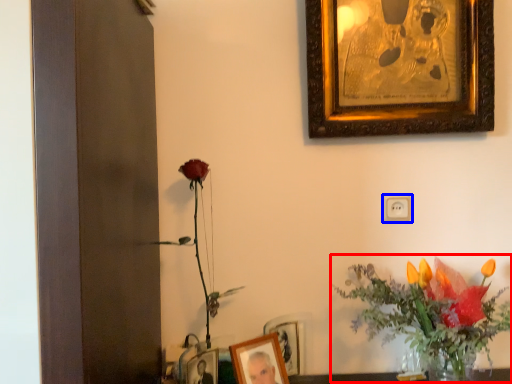
Question: Which object appears closest to the camera in this image, floral arrangement (highlighted by a red box) or electric outlet (highlighted by a blue box)?

Choices:
 (A) floral arrangement
 (B) electric outlet

Answer: (A)